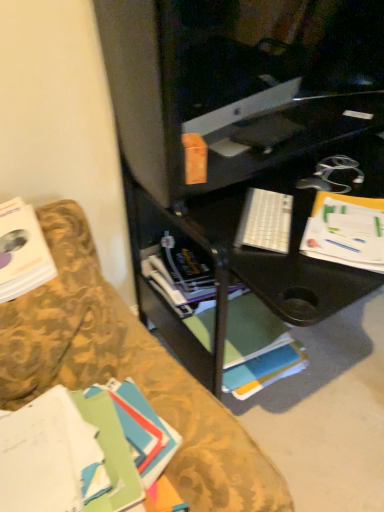
Identify the location of free point above white plastic keyboard at center (from a real-world perspective). (276, 211).